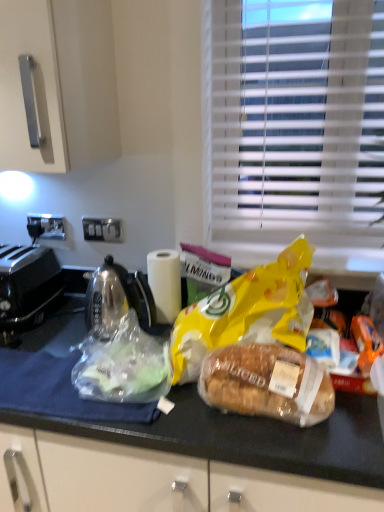
Question: Is yellow matte plastic bag at center, marked as the second plastic bag in a left-to-right arrangement, positioned behind translucent plastic bag at center, which is the 1th plastic bag in left-to-right order?

Choices:
 (A) yes
 (B) no

Answer: (B)

Question: Does yellow matte plastic bag at center, marked as the second plastic bag in a left-to-right arrangement, have a greater width compared to translucent plastic bag at center, positioned as the second plastic bag in right-to-left order?

Choices:
 (A) yes
 (B) no

Answer: (A)

Question: Can you confirm if yellow matte plastic bag at center, marked as the second plastic bag in a left-to-right arrangement, is smaller than translucent plastic bag at center, positioned as the second plastic bag in right-to-left order?

Choices:
 (A) no
 (B) yes

Answer: (A)

Question: Can you confirm if yellow matte plastic bag at center, the first plastic bag viewed from the right, is shorter than translucent plastic bag at center, positioned as the second plastic bag in right-to-left order?

Choices:
 (A) no
 (B) yes

Answer: (A)

Question: From the image's perspective, is yellow matte plastic bag at center, marked as the second plastic bag in a left-to-right arrangement, under translucent plastic bag at center, which is the 1th plastic bag in left-to-right order?

Choices:
 (A) no
 (B) yes

Answer: (A)

Question: Is black plastic toaster at left situated inside white matte paper towel at center or outside?

Choices:
 (A) inside
 (B) outside

Answer: (B)

Question: Does point (6, 300) appear closer or farther from the camera than point (168, 251)?

Choices:
 (A) farther
 (B) closer

Answer: (B)

Question: Looking at their shapes, would you say black plastic toaster at left is wider or thinner than white matte paper towel at center?

Choices:
 (A) thin
 (B) wide

Answer: (B)

Question: In the image, is black plastic toaster at left positioned in front of or behind white matte paper towel at center?

Choices:
 (A) behind
 (B) front

Answer: (B)

Question: Is translucent plastic bag at center inside or outside of black plastic toaster at left?

Choices:
 (A) outside
 (B) inside

Answer: (A)

Question: Is translucent plastic bag at center wider or thinner than black plastic toaster at left?

Choices:
 (A) thin
 (B) wide

Answer: (A)

Question: Is translucent plastic bag at center to the left or to the right of black plastic toaster at left in the image?

Choices:
 (A) left
 (B) right

Answer: (B)

Question: Is translucent plastic bag at center taller or shorter than black plastic toaster at left?

Choices:
 (A) short
 (B) tall

Answer: (A)

Question: Considering the positions of point (155, 293) and point (139, 358), is point (155, 293) closer or farther from the camera than point (139, 358)?

Choices:
 (A) closer
 (B) farther

Answer: (B)

Question: In the image, is white matte paper towel at center on the left side or the right side of translucent plastic bag at center, positioned as the second plastic bag in right-to-left order?

Choices:
 (A) left
 (B) right

Answer: (B)